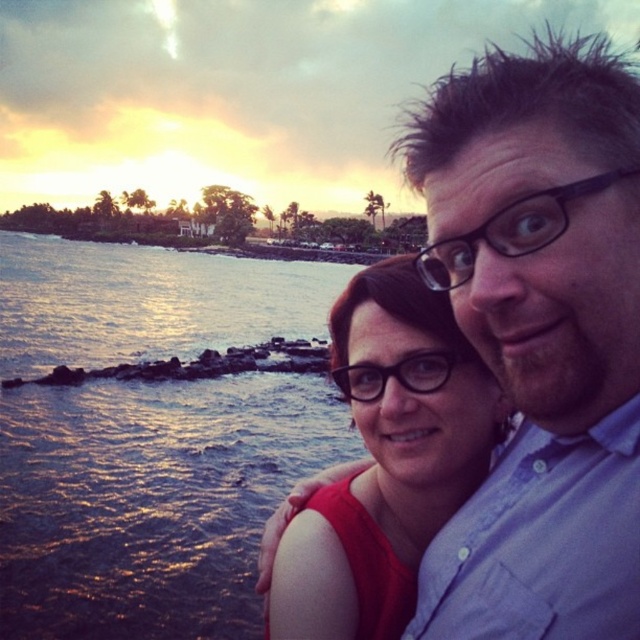
Is matte black hair at upper center above matte red dress at center?

Indeed, matte black hair at upper center is positioned over matte red dress at center.

Who is higher up, matte black hair at upper center or matte red dress at center?

matte black hair at upper center

Describe the element at coordinates (540, 337) in the screenshot. I see `matte black hair at upper center` at that location.

The width and height of the screenshot is (640, 640). I want to click on matte black hair at upper center, so click(x=540, y=337).

Looking at this image, is matte black hair at upper center behind shiny blue water at lower left?

No, matte black hair at upper center is closer to the viewer.

Is matte black hair at upper center to the left of shiny blue water at lower left from the viewer's perspective?

In fact, matte black hair at upper center is to the right of shiny blue water at lower left.

Image resolution: width=640 pixels, height=640 pixels. What do you see at coordinates (540, 337) in the screenshot? I see `matte black hair at upper center` at bounding box center [540, 337].

Locate an element on the screen. This screenshot has width=640, height=640. matte black hair at upper center is located at coordinates (540, 337).

Does shiny blue water at lower left have a lesser height compared to matte red dress at center?

In fact, shiny blue water at lower left may be taller than matte red dress at center.

Between shiny blue water at lower left and matte red dress at center, which one is positioned higher?

Positioned higher is shiny blue water at lower left.

Locate an element on the screen. shiny blue water at lower left is located at coordinates (150, 500).